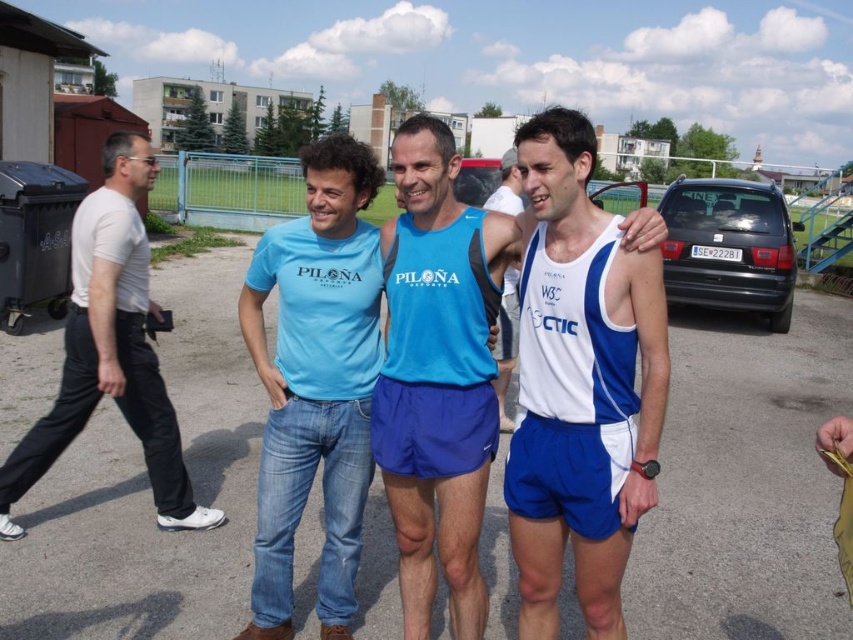
Question: Based on their relative distances, which object is nearer to the white matte t-shirt at left?

Choices:
 (A) light blue cotton t-shirt at center
 (B) white/blue athletic tank top at center

Answer: (A)

Question: Is white matte t-shirt at left smaller than white/blue athletic shorts at center?

Choices:
 (A) yes
 (B) no

Answer: (A)

Question: Considering the relative positions of light blue cotton t-shirt at center and white matte t-shirt at left in the image provided, where is light blue cotton t-shirt at center located with respect to white matte t-shirt at left?

Choices:
 (A) below
 (B) above

Answer: (A)

Question: Which point appears closest to the camera in this image?

Choices:
 (A) (505, 364)
 (B) (138, 332)
 (C) (64, 518)

Answer: (B)

Question: Which of the following is the closest to the observer?

Choices:
 (A) blue fabric shorts at center
 (B) white/blue athletic shorts at center
 (C) light blue cotton t-shirt at center

Answer: (B)

Question: Is white matte t-shirt at left to the left of white/blue athletic shorts at center from the viewer's perspective?

Choices:
 (A) no
 (B) yes

Answer: (B)